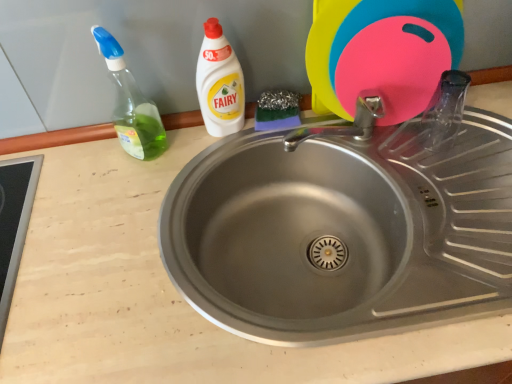
You are a GUI agent. You are given a task and a screenshot of the screen. Output one action in this format:
    pyautogui.click(x=<x>, y=<y>)
    Task: Click on the free space between green translucent bottle at left and white plastic bottle at upper center
    The height and width of the screenshot is (384, 512).
    Given the screenshot: What is the action you would take?
    click(189, 144)